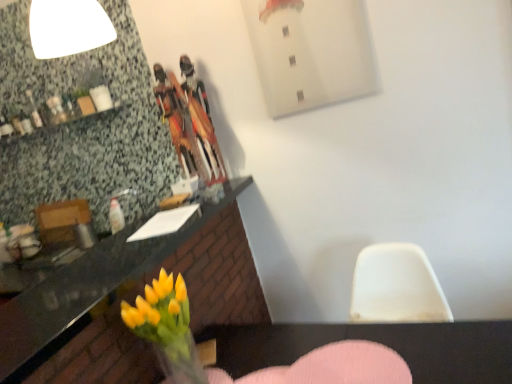
Question: Considering the relative positions of yellow glass vase at lower left and pink fabric armchair at lower center in the image provided, is yellow glass vase at lower left to the left of pink fabric armchair at lower center from the viewer's perspective?

Choices:
 (A) yes
 (B) no

Answer: (A)

Question: Is yellow glass vase at lower left taller than pink fabric armchair at lower center?

Choices:
 (A) no
 (B) yes

Answer: (B)

Question: Does yellow glass vase at lower left contain pink fabric armchair at lower center?

Choices:
 (A) yes
 (B) no

Answer: (B)

Question: From a real-world perspective, does yellow glass vase at lower left stand above pink fabric armchair at lower center?

Choices:
 (A) yes
 (B) no

Answer: (A)

Question: Would you say yellow glass vase at lower left is a long distance from pink fabric armchair at lower center?

Choices:
 (A) yes
 (B) no

Answer: (B)

Question: Is yellow glass vase at lower left completely or partially outside of pink fabric armchair at lower center?

Choices:
 (A) yes
 (B) no

Answer: (A)

Question: Is yellow glass vase at lower left looking in the opposite direction of granite countertop at lower left?

Choices:
 (A) yes
 (B) no

Answer: (B)

Question: Can you confirm if yellow glass vase at lower left is smaller than granite countertop at lower left?

Choices:
 (A) yes
 (B) no

Answer: (A)

Question: Is yellow glass vase at lower left to the right of granite countertop at lower left from the viewer's perspective?

Choices:
 (A) no
 (B) yes

Answer: (B)

Question: Does yellow glass vase at lower left have a lesser height compared to granite countertop at lower left?

Choices:
 (A) no
 (B) yes

Answer: (A)

Question: Does yellow glass vase at lower left appear on the left side of granite countertop at lower left?

Choices:
 (A) yes
 (B) no

Answer: (B)

Question: From a real-world perspective, is yellow glass vase at lower left under granite countertop at lower left?

Choices:
 (A) yes
 (B) no

Answer: (A)

Question: Is pink fabric armchair at lower center with granite countertop at lower left?

Choices:
 (A) yes
 (B) no

Answer: (B)